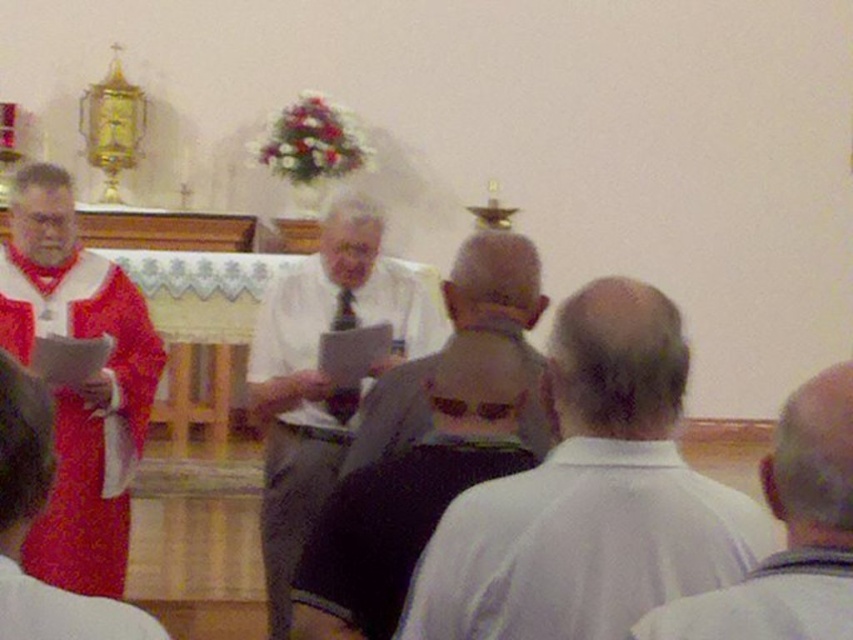
Looking at this image, you are standing at the point marked as point (813, 584). You want to walk to the altar. Is there enough space to walk straight ahead without needing to move around any obstacles?

The point (813, 584) is 4.00 feet away from the altar. Since there are no obstacles mentioned in the scene description between the point and the altar, you can walk straight ahead towards the altar without needing to move around any obstacles.

You are standing in the church and want to take a photo of the altar. The camera you are using has a focal length of 50mm and a sensor size of 24mm x 36mm. The point at coordinate point (526, 548) is crucial for focusing. Given that the point is 5.23 feet away from the camera, what is the minimum distance you should set the focus to ensure the altar is sharp?

The minimum focus distance should be set to 5.23 feet because the point at coordinate point (526, 548) is exactly 5.23 feet away from the camera, ensuring the altar is in sharp focus.